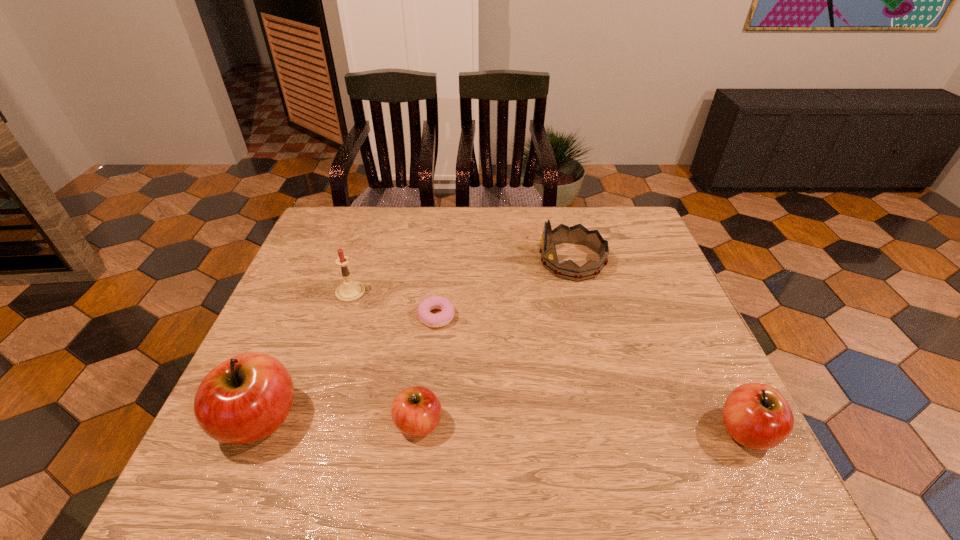
I want to click on the tallest apple, so click(246, 398).

At what (x,y) coordinates should I click in order to perform the action: click on the shortest apple. Please return your answer as a coordinate pair (x, y). The height and width of the screenshot is (540, 960). Looking at the image, I should click on (416, 411).

I want to click on the fifth tallest object, so click(416, 411).

This screenshot has width=960, height=540. I want to click on the rightmost apple, so [757, 416].

You are a GUI agent. You are given a task and a screenshot of the screen. Output one action in this format:
    pyautogui.click(x=<x>, y=<y>)
    Task: Click on the fourth tallest object
    Image resolution: width=960 pixels, height=540 pixels.
    Given the screenshot: What is the action you would take?
    pyautogui.click(x=757, y=416)

Image resolution: width=960 pixels, height=540 pixels. What are the coordinates of `tiara` in the screenshot? It's located at (578, 234).

I want to click on the shortest object, so click(425, 306).

At what (x,y) coordinates should I click in order to perform the action: click on pastry. Please return your answer as a coordinate pair (x, y). The width and height of the screenshot is (960, 540). Looking at the image, I should click on (425, 306).

Where is `candle`? candle is located at coordinates (349, 291).

This screenshot has width=960, height=540. Find the location of `vacant space located 0.270m on the right of the tallest apple`. vacant space located 0.270m on the right of the tallest apple is located at coordinates (430, 419).